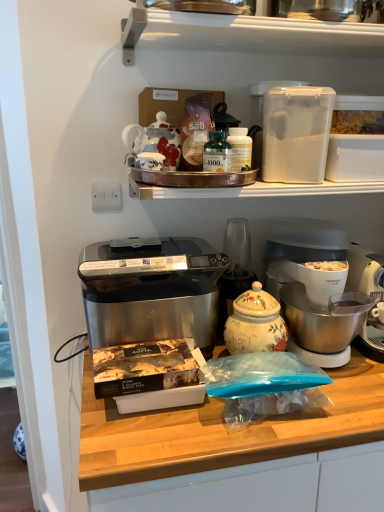
Locate an element on the screen. The height and width of the screenshot is (512, 384). vacant area situated below transparent plastic container at upper right, which appears as the second appliance when viewed from the left (from a real-world perspective) is located at coordinates (293, 185).